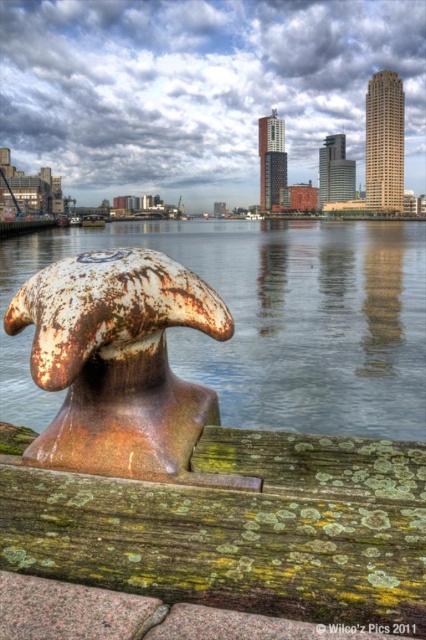
Does green mossy wood at lower center have a lesser width compared to rusty metal bollard at left?

Indeed, green mossy wood at lower center has a lesser width compared to rusty metal bollard at left.

Is green mossy wood at lower center positioned behind rusty metal bollard at left?

Yes, it is.

Between point (374, 456) and point (207, 481), which one is positioned in front?

Point (207, 481)

This screenshot has width=426, height=640. What are the coordinates of `green mossy wood at lower center` in the screenshot? It's located at (241, 529).

At what (x,y) coordinates should I click in order to perform the action: click on green mossy wood at lower center. Please return your answer as a coordinate pair (x, y). The width and height of the screenshot is (426, 640). Looking at the image, I should click on (241, 529).

I want to click on green mossy wood at lower center, so click(x=241, y=529).

Is point (172, 236) farther from viewer compared to point (132, 387)?

That is True.

Does rusty metal bollard at lower left lie in front of rusty metal bollard at left?

No, it is behind rusty metal bollard at left.

Locate an element on the screen. The image size is (426, 640). rusty metal bollard at lower left is located at coordinates (268, 321).